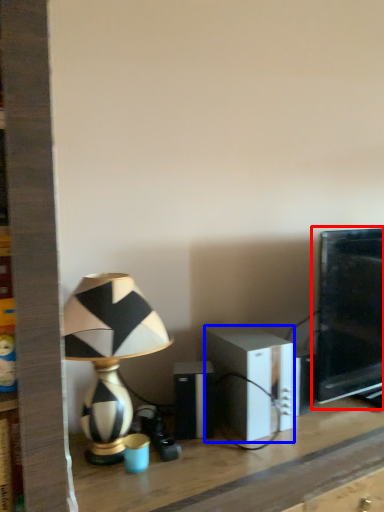
Question: Among these objects, which one is nearest to the camera, computer monitor (highlighted by a red box) or speaker (highlighted by a blue box)?

Choices:
 (A) computer monitor
 (B) speaker

Answer: (B)